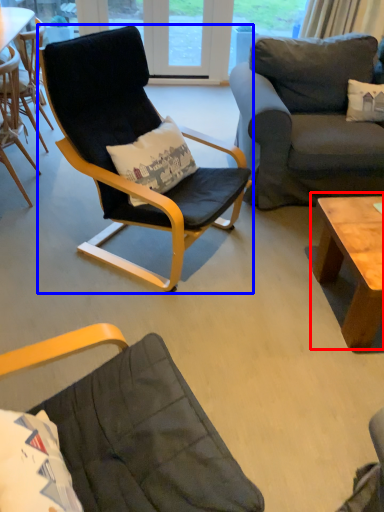
Question: Among these objects, which one is nearest to the camera, coffee table (highlighted by a red box) or chair (highlighted by a blue box)?

Choices:
 (A) coffee table
 (B) chair

Answer: (B)